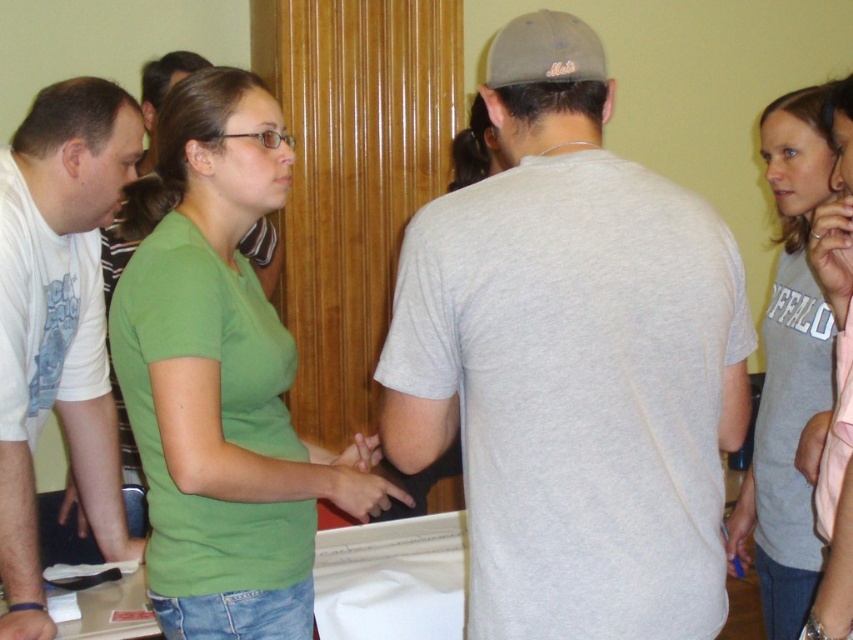
Question: Which of the following is the closest to the observer?

Choices:
 (A) (183, 512)
 (B) (91, 456)
 (C) (646, 218)

Answer: (C)

Question: From the image, what is the correct spatial relationship of white matte t-shirt at left in relation to matte green t-shirt at center?

Choices:
 (A) right
 (B) left

Answer: (A)

Question: Which object appears closest to the camera in this image?

Choices:
 (A) gray cotton shirt at upper right
 (B) white matte t-shirt at left
 (C) gray cotton t-shirt at center

Answer: (C)

Question: Which point is closer to the camera?

Choices:
 (A) gray cotton t-shirt at center
 (B) pink fabric shirt at upper right
 (C) matte green t-shirt at center

Answer: (A)

Question: Does gray cotton shirt at upper right appear on the right side of pink fabric shirt at upper right?

Choices:
 (A) no
 (B) yes

Answer: (B)

Question: Does green matte shirt at center have a greater width compared to gray cotton shirt at upper right?

Choices:
 (A) yes
 (B) no

Answer: (A)